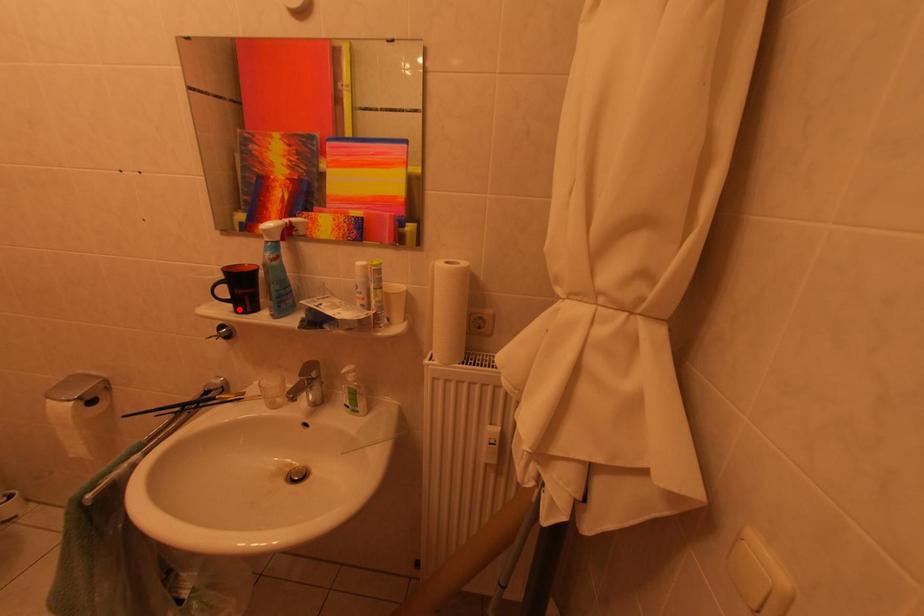
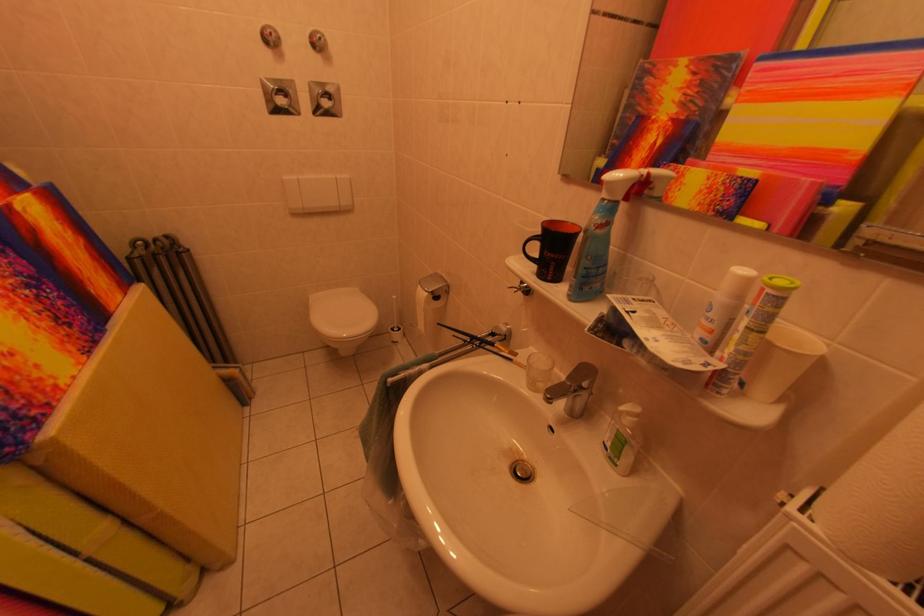
In the second image, find the point that corresponds to the highlighted location in the first image.

(543, 270)